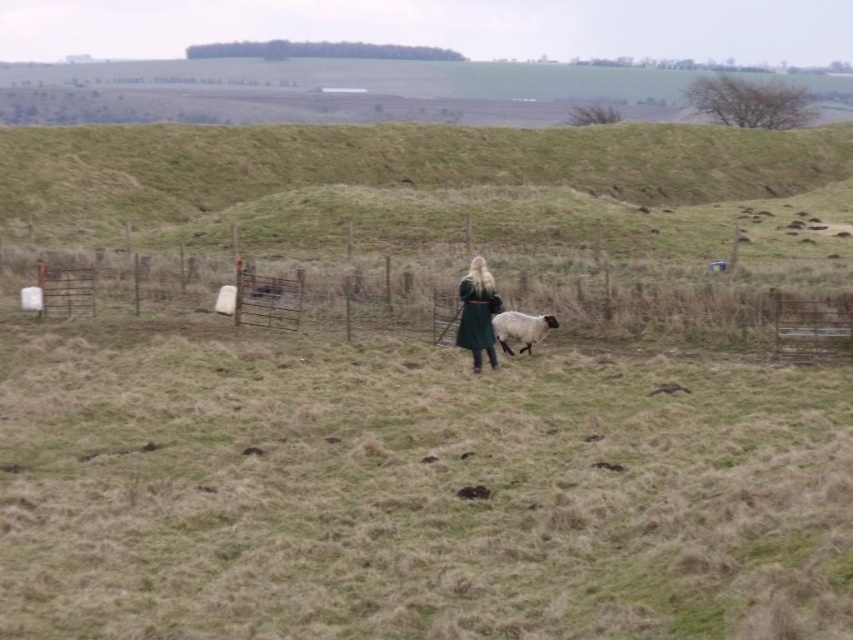
Question: Which is farther from the white woolly sheep at center?

Choices:
 (A) green grassy field at center
 (B) green woolen coat at center

Answer: (A)

Question: Is the position of green grassy field at center less distant than that of metal wire fence at center?

Choices:
 (A) no
 (B) yes

Answer: (B)

Question: Which point is farther to the camera?

Choices:
 (A) green woolen coat at center
 (B) green grassy field at center
 (C) white woolly sheep at center
 (D) metal wire fence at center

Answer: (C)

Question: Among these objects, which one is farthest from the camera?

Choices:
 (A) green woolen coat at center
 (B) metal wire fence at center

Answer: (B)

Question: Can you confirm if green grassy field at center is bigger than green woolen coat at center?

Choices:
 (A) yes
 (B) no

Answer: (A)

Question: Can you confirm if metal wire fence at center is positioned to the left of white woolly sheep at center?

Choices:
 (A) no
 (B) yes

Answer: (B)